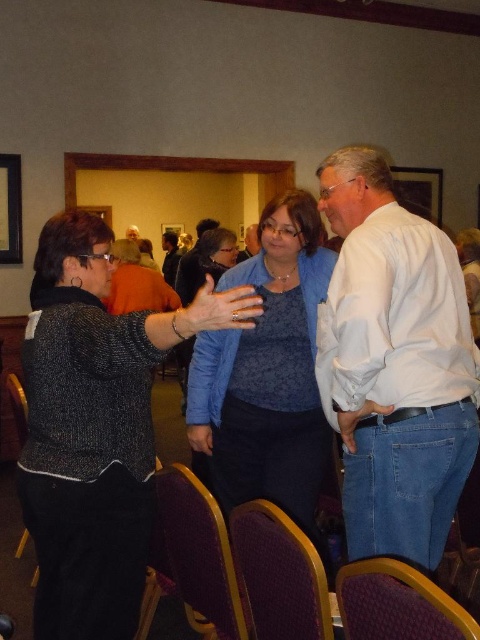
Question: Can you confirm if purple fabric chair at lower center is positioned above blue fabric shirt at center?

Choices:
 (A) yes
 (B) no

Answer: (B)

Question: Can you confirm if black textured sweater at left is positioned below white cotton shirt at right?

Choices:
 (A) no
 (B) yes

Answer: (B)

Question: Which of the following is the farthest from the observer?

Choices:
 (A) purple fabric chair at lower center
 (B) black textured sweater at left
 (C) white cotton shirt at right
 (D) velvet purple chair at center

Answer: (A)

Question: Among these points, which one is nearest to the camera?

Choices:
 (A) (257, 563)
 (B) (183, 401)
 (C) (385, 572)
 (D) (168, 268)

Answer: (C)

Question: Which object is closer to the camera taking this photo?

Choices:
 (A) matte black jacket at center
 (B) black textured sweater at left
 (C) blue textured sweater at center
 (D) velvet purple chair at lower center

Answer: (D)

Question: Can you confirm if blue textured sweater at center is positioned to the right of matte black jacket at center?

Choices:
 (A) no
 (B) yes

Answer: (B)